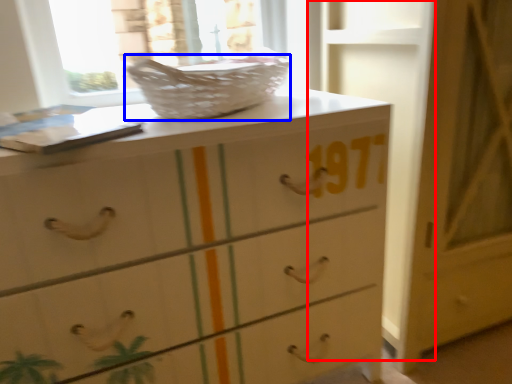
Question: Which object appears farthest to the camera in this image, door (highlighted by a red box) or basket (highlighted by a blue box)?

Choices:
 (A) door
 (B) basket

Answer: (A)